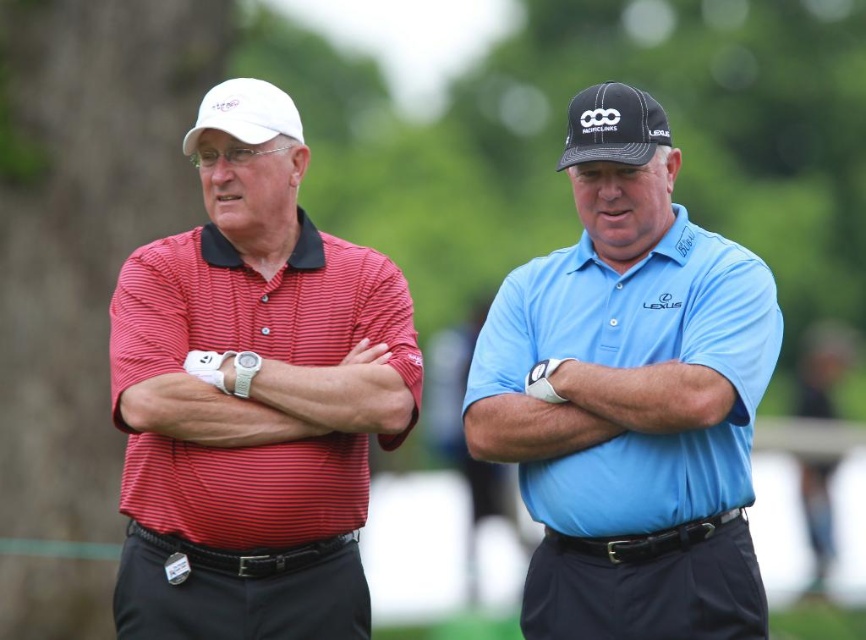
Does blue smooth polo shirt at center have a larger size compared to white matte baseball cap at upper left?

Indeed, blue smooth polo shirt at center has a larger size compared to white matte baseball cap at upper left.

Does point (761, 305) come in front of point (257, 134)?

Yes, it is.

Identify the location of blue smooth polo shirt at center. (630, 396).

Can you confirm if matte red striped polo shirt at left is positioned below red striped shirt at left?

Actually, matte red striped polo shirt at left is above red striped shirt at left.

Is matte red striped polo shirt at left thinner than red striped shirt at left?

No, matte red striped polo shirt at left is not thinner than red striped shirt at left.

Is point (326, 525) farther from viewer compared to point (118, 417)?

That is True.

Where is `matte red striped polo shirt at left`? matte red striped polo shirt at left is located at coordinates (251, 396).

Between matte red striped polo shirt at left and white matte baseball cap at upper left, which one has less height?

white matte baseball cap at upper left

Who is higher up, matte red striped polo shirt at left or white matte baseball cap at upper left?

Positioned higher is white matte baseball cap at upper left.

Is point (141, 545) positioned behind point (211, 92)?

No, it is in front of (211, 92).

Where is `matte red striped polo shirt at left`? This screenshot has height=640, width=866. matte red striped polo shirt at left is located at coordinates (251, 396).